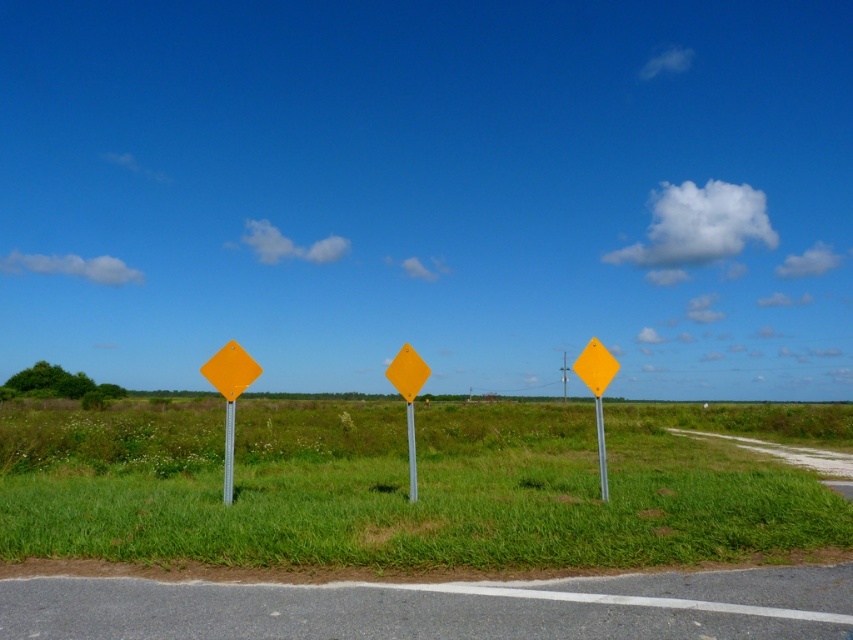
Question: Which is nearer to the yellow plastic signpost at center?

Choices:
 (A) yellow plastic pole at center
 (B) yellow plastic signpost at left
 (C) matte yellow diamond at left
 (D) green grass at center

Answer: (C)

Question: Among these points, which one is farthest from the camera?

Choices:
 (A) (418, 369)
 (B) (247, 364)
 (C) (229, 433)

Answer: (A)

Question: Can you confirm if matte yellow diamond at left is thinner than yellow diamond-shaped sign at center?

Choices:
 (A) yes
 (B) no

Answer: (B)

Question: Does green grass at center appear over yellow diamond-shaped sign at center?

Choices:
 (A) yes
 (B) no

Answer: (B)

Question: Which object is farther from the camera taking this photo?

Choices:
 (A) green grass at center
 (B) yellow diamond-shaped sign at left

Answer: (B)

Question: Can you confirm if matte yellow diamond at left is bigger than yellow plastic pole at center?

Choices:
 (A) yes
 (B) no

Answer: (A)